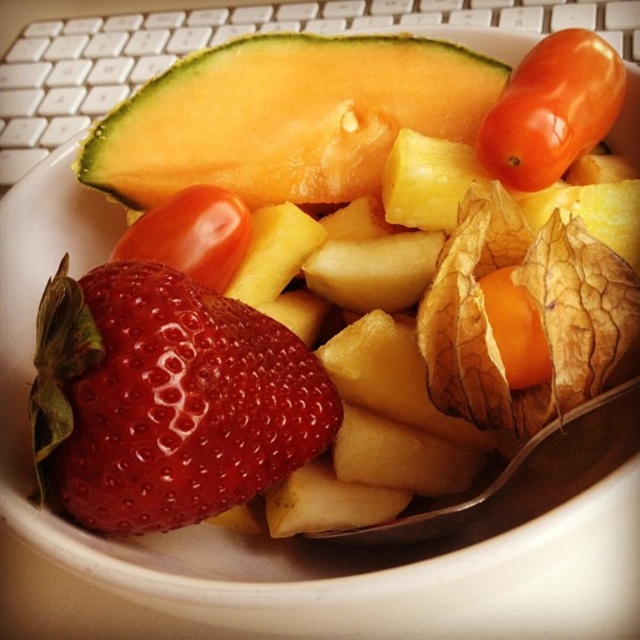
Question: Estimate the real-world distances between objects in this image. Which object is closer to the glossy tomato at center?

Choices:
 (A) yellowish-green textured cantaloupe at upper left
 (B) glossy orange tomato at upper right
 (C) orange translucent physalis at center
 (D) shiny red strawberry at center-left

Answer: (A)

Question: Can you confirm if shiny red strawberry at center-left is positioned below orange translucent physalis at center?

Choices:
 (A) no
 (B) yes

Answer: (B)

Question: Which point is farther from the camera taking this photo?

Choices:
 (A) (524, 292)
 (B) (333, 58)

Answer: (B)

Question: Is yellowish-green textured cantaloupe at upper left bigger than glossy tomato at center?

Choices:
 (A) yes
 (B) no

Answer: (A)

Question: Can you confirm if glossy orange tomato at upper right is positioned above orange translucent physalis at center?

Choices:
 (A) no
 (B) yes

Answer: (B)

Question: Among these points, which one is farthest from the camera?

Choices:
 (A) (227, 76)
 (B) (179, 404)
 (C) (528, 324)

Answer: (A)